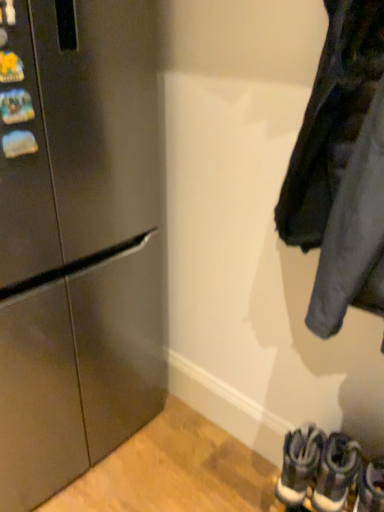
Question: Does white leather sneakers at lower right, arranged as the 3th footwear when viewed from the left, come in front of stainless steel refrigerator at left?

Choices:
 (A) no
 (B) yes

Answer: (A)

Question: Is white leather sneakers at lower right, the first footwear in the right-to-left sequence, shorter than stainless steel refrigerator at left?

Choices:
 (A) yes
 (B) no

Answer: (A)

Question: From the image's perspective, does white leather sneakers at lower right, the first footwear in the right-to-left sequence, appear higher than stainless steel refrigerator at left?

Choices:
 (A) no
 (B) yes

Answer: (A)

Question: Is white leather sneakers at lower right, arranged as the 3th footwear when viewed from the left, wider than stainless steel refrigerator at left?

Choices:
 (A) yes
 (B) no

Answer: (B)

Question: Are white leather sneakers at lower right, arranged as the 3th footwear when viewed from the left, and stainless steel refrigerator at left beside each other?

Choices:
 (A) no
 (B) yes

Answer: (A)

Question: Considering the positions of dark gray fabric jacket at right and stainless steel refrigerator at left in the image, is dark gray fabric jacket at right taller or shorter than stainless steel refrigerator at left?

Choices:
 (A) tall
 (B) short

Answer: (B)

Question: Relative to stainless steel refrigerator at left, is dark gray fabric jacket at right in front or behind?

Choices:
 (A) front
 (B) behind

Answer: (A)

Question: Considering the positions of point (316, 162) and point (43, 401), is point (316, 162) closer or farther from the camera than point (43, 401)?

Choices:
 (A) closer
 (B) farther

Answer: (A)

Question: Is dark gray fabric jacket at right wider or thinner than stainless steel refrigerator at left?

Choices:
 (A) thin
 (B) wide

Answer: (A)

Question: In terms of height, does dark gray fabric jacket at right look taller or shorter compared to dark gray suede sneakers at lower right, which is counted as the second footwear, starting from the left?

Choices:
 (A) tall
 (B) short

Answer: (A)

Question: Is dark gray fabric jacket at right wider or thinner than dark gray suede sneakers at lower right, the 2th footwear from the right?

Choices:
 (A) wide
 (B) thin

Answer: (A)

Question: Would you say dark gray fabric jacket at right is inside or outside dark gray suede sneakers at lower right, which is counted as the second footwear, starting from the left?

Choices:
 (A) outside
 (B) inside

Answer: (A)

Question: Considering the positions of point (331, 74) and point (344, 482), is point (331, 74) closer or farther from the camera than point (344, 482)?

Choices:
 (A) farther
 (B) closer

Answer: (B)

Question: Considering the positions of dark gray suede sneakers at lower right, which is counted as the second footwear, starting from the left, and stainless steel refrigerator at left in the image, is dark gray suede sneakers at lower right, which is counted as the second footwear, starting from the left, taller or shorter than stainless steel refrigerator at left?

Choices:
 (A) tall
 (B) short

Answer: (B)

Question: From the image's perspective, relative to stainless steel refrigerator at left, is dark gray suede sneakers at lower right, which is counted as the second footwear, starting from the left, above or below?

Choices:
 (A) below
 (B) above

Answer: (A)